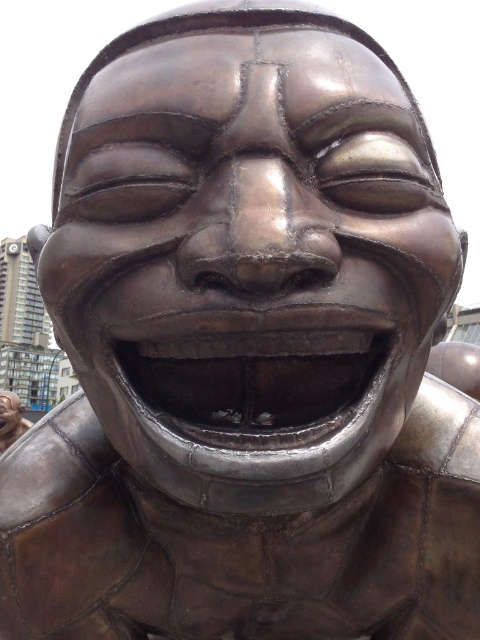
You are an art student analyzing the sculpture. You notice the shiny metallic mouth at center and the bronze statue at lower left. Which object is positioned higher in the image?

The shiny metallic mouth at center is located above the bronze statue at lower left, so it is positioned higher in the image.